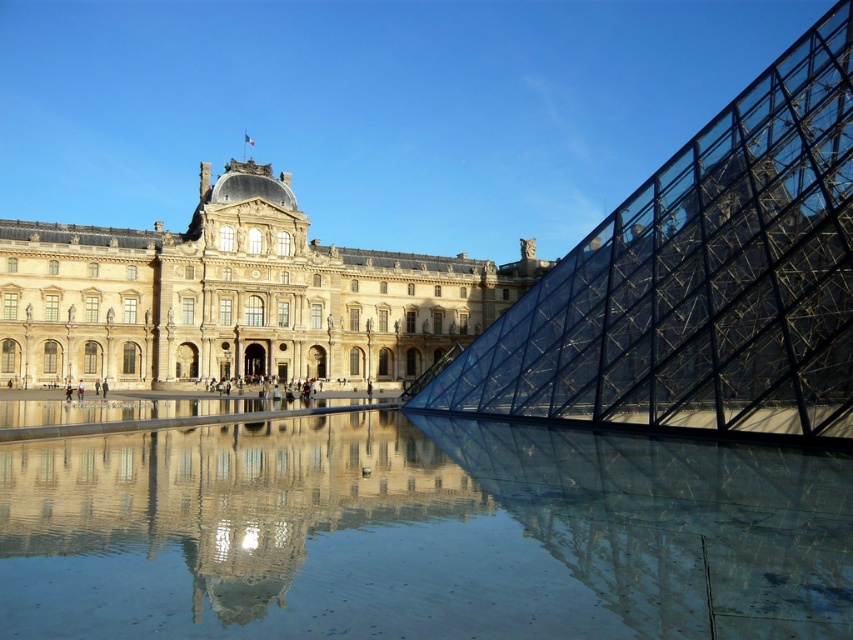
Which is more to the left, transparent glass water at center or beige stone palace at center?

Positioned to the left is beige stone palace at center.

Can you confirm if transparent glass water at center is shorter than beige stone palace at center?

Indeed, transparent glass water at center has a lesser height compared to beige stone palace at center.

Locate an element on the screen. The width and height of the screenshot is (853, 640). transparent glass water at center is located at coordinates (421, 532).

Where is `transparent glass water at center`? The height and width of the screenshot is (640, 853). transparent glass water at center is located at coordinates (421, 532).